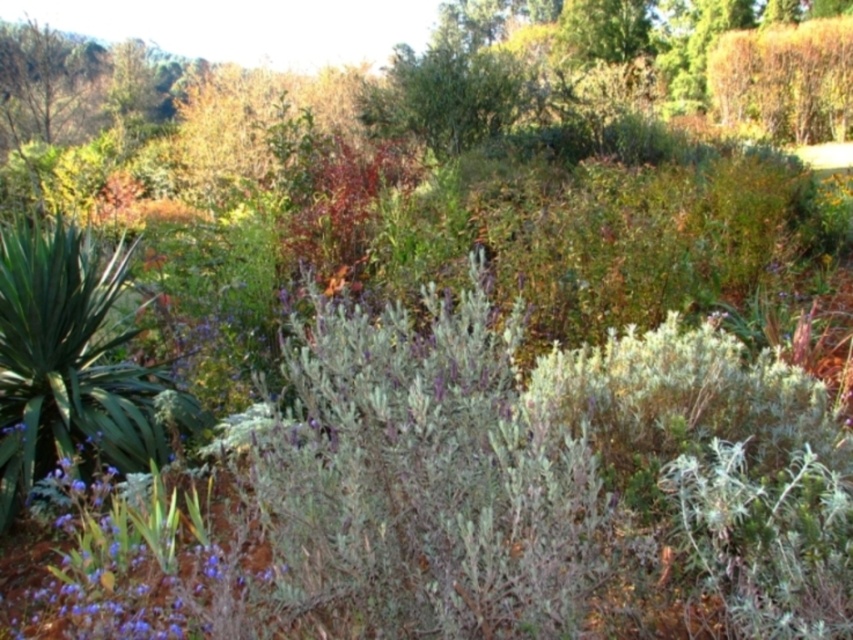
Between green leafy plant at left and purple matte flower at lower left, which one is positioned lower?

purple matte flower at lower left

Between point (26, 371) and point (96, 563), which one is positioned behind?

The point (26, 371) is behind.

Is point (70, 376) farther from viewer compared to point (97, 580)?

Yes.

What are the coordinates of `green leafy plant at left` in the screenshot? It's located at (65, 360).